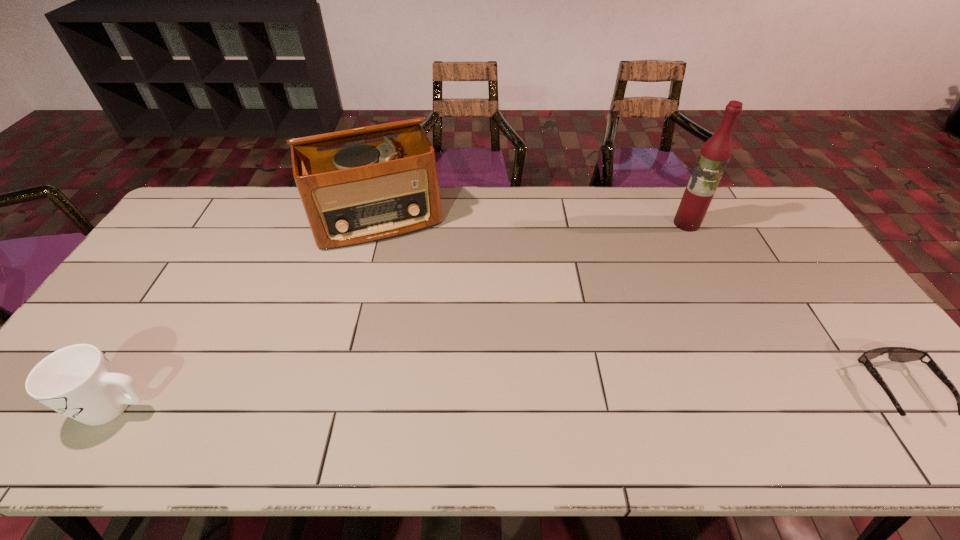
In the image, there is a desktop. Identify the location of free space at the far right corner. (774, 225).

Identify the location of free spot between the mug and the third object from left to right. The width and height of the screenshot is (960, 540). (402, 315).

This screenshot has height=540, width=960. Identify the location of vacant space that's between the third object from left to right and the third object from right to left. (532, 221).

Image resolution: width=960 pixels, height=540 pixels. I want to click on vacant area that lies between the third object from left to right and the radio receiver, so click(532, 221).

Locate an element on the screen. vacant space that is in between the second object from right to left and the mug is located at coordinates (402, 315).

You are a GUI agent. You are given a task and a screenshot of the screen. Output one action in this format:
    pyautogui.click(x=<x>, y=<y>)
    Task: Click on the vacant space that's between the second object from left to right and the mug
    This screenshot has width=960, height=540.
    Given the screenshot: What is the action you would take?
    pyautogui.click(x=248, y=313)

Where is `free spot between the third tallest object and the second object from left to right`? This screenshot has width=960, height=540. free spot between the third tallest object and the second object from left to right is located at coordinates (248, 313).

Identify the location of the third closest object to the liquor. Image resolution: width=960 pixels, height=540 pixels. (78, 381).

Identify which object is the second nearest to the radio receiver. Please provide its 2D coordinates. Your answer should be formatted as a tuple, i.e. [(x, y)], where the tuple contains the x and y coordinates of a point satisfying the conditions above.

[(715, 153)]